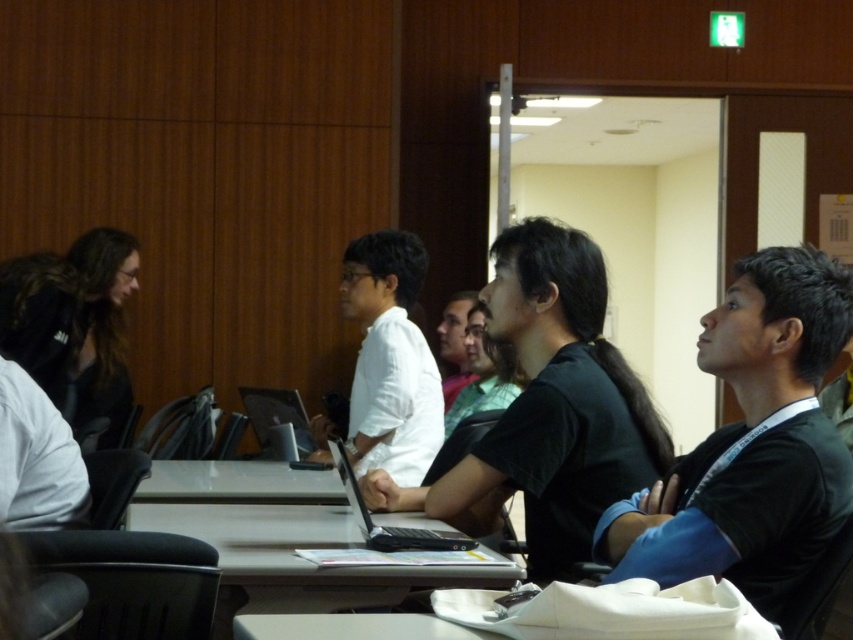
Question: Does black matte shirt at center lie in front of black glossy laptop at center?

Choices:
 (A) no
 (B) yes

Answer: (A)

Question: Which point is farther to the camera?

Choices:
 (A) black glossy laptop at center
 (B) black matte shirt at center

Answer: (B)

Question: Does black matte shirt at center appear on the left side of black glossy laptop at center?

Choices:
 (A) no
 (B) yes

Answer: (A)

Question: Which of the following is the farthest from the observer?

Choices:
 (A) black glossy laptop at center
 (B) black matte shirt at center

Answer: (B)

Question: Can you confirm if black matte shirt at center is wider than black glossy laptop at center?

Choices:
 (A) no
 (B) yes

Answer: (B)